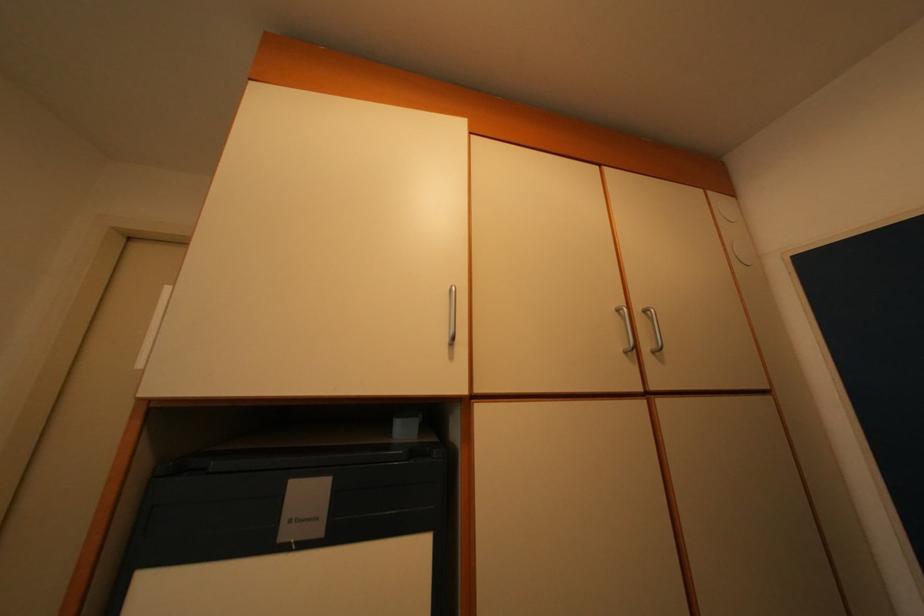
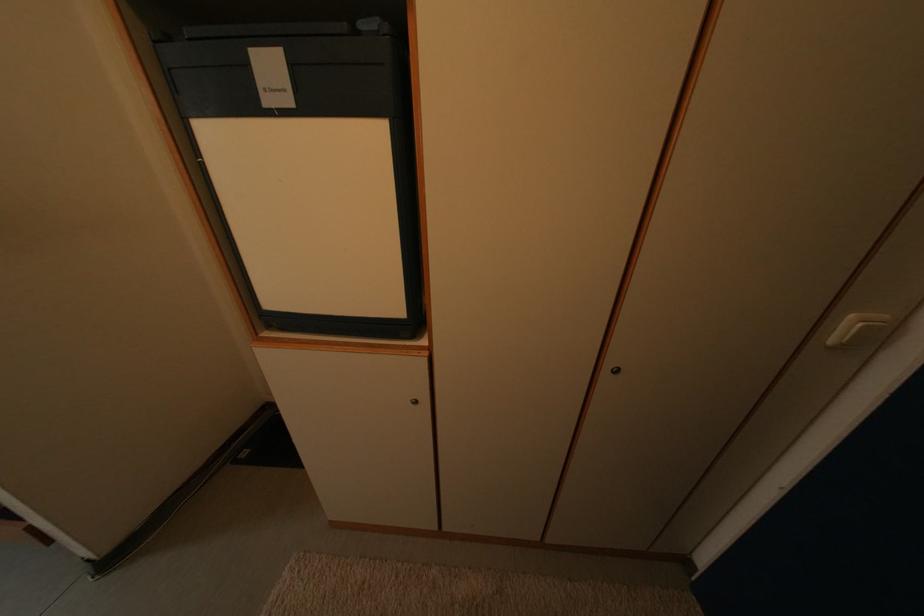
First-person continuous shooting, in which direction is the camera rotating?

The camera's rotation is toward left-down.